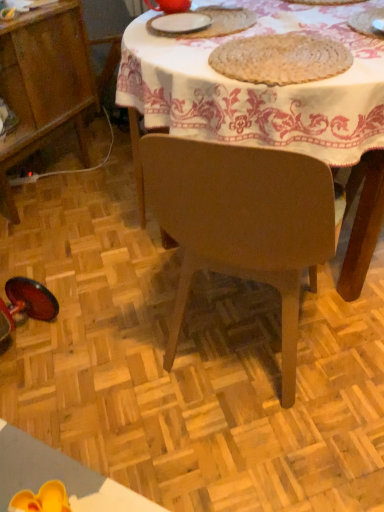
The height and width of the screenshot is (512, 384). What are the coordinates of `brown woven placemat at upper center` in the screenshot? It's located at (281, 58).

How much space does white woven placemat at upper right, which appears as the 3th tableware when viewed from the left, occupy horizontally?

15.58 inches.

Image resolution: width=384 pixels, height=512 pixels. Find the location of `white matte plate at upper center, marked as the 2th tableware in a right-to-left arrangement`. white matte plate at upper center, marked as the 2th tableware in a right-to-left arrangement is located at coordinates (179, 23).

Where is `brown woven placemat at upper center`? The image size is (384, 512). brown woven placemat at upper center is located at coordinates (281, 58).

How much distance is there between white woven placemat at upper right, which appears as the 3th tableware when viewed from the left, and brown woven placemat at upper center?

white woven placemat at upper right, which appears as the 3th tableware when viewed from the left, is 12.32 inches away from brown woven placemat at upper center.

Who is smaller, white woven placemat at upper right, which appears as the 3th tableware when viewed from the left, or brown woven placemat at upper center?

brown woven placemat at upper center is smaller.

Choose the correct answer: Is white woven placemat at upper right, which ranks as the 1th tableware in right-to-left order, inside brown woven placemat at upper center or outside it?

white woven placemat at upper right, which ranks as the 1th tableware in right-to-left order, exists outside the volume of brown woven placemat at upper center.

What's the angular difference between white woven placemat at upper right, which ranks as the 1th tableware in right-to-left order, and brown woven placemat at upper center's facing directions?

There is a 0.000447-degree angle between the facing directions of white woven placemat at upper right, which ranks as the 1th tableware in right-to-left order, and brown woven placemat at upper center.

From the image's perspective, is white matte plate at upper center, marked as the 2th tableware in a right-to-left arrangement, on top of brown woven placemat at upper center?

Yes, from the image's perspective, white matte plate at upper center, marked as the 2th tableware in a right-to-left arrangement, is above brown woven placemat at upper center.

Is white matte plate at upper center, marked as the 2th tableware in a right-to-left arrangement, inside the boundaries of brown woven placemat at upper center, or outside?

white matte plate at upper center, marked as the 2th tableware in a right-to-left arrangement, is spatially situated outside brown woven placemat at upper center.

In the scene shown: Is white matte plate at upper center, marked as the 2th tableware in a right-to-left arrangement, further to camera compared to brown woven placemat at upper center?

Yes, white matte plate at upper center, marked as the 2th tableware in a right-to-left arrangement, is further from the viewer.

Is white matte plate at upper center, the 2th tableware in the left-to-right sequence, aimed at brown woven placemat at upper center?

No.

From the image's perspective, is wooden cabinet at lower left beneath brown woven placemat at upper center?

Incorrect, from the image's perspective, wooden cabinet at lower left is higher than brown woven placemat at upper center.

Does wooden cabinet at lower left have a greater width compared to brown woven placemat at upper center?

Yes.

Is brown woven placemat at upper center at the back of wooden cabinet at lower left?

No, brown woven placemat at upper center is not at the back of wooden cabinet at lower left.

From the image's perspective, which is below, wooden cabinet at lower left or wooden table at center?

wooden table at center appears lower in the image.

Considering the relative sizes of wooden cabinet at lower left and wooden table at center in the image provided, is wooden cabinet at lower left shorter than wooden table at center?

Indeed, wooden cabinet at lower left has a lesser height compared to wooden table at center.

Between wooden cabinet at lower left and wooden table at center, which one has smaller size?

Smaller between the two is wooden cabinet at lower left.

Considering the sizes of objects wooden cabinet at lower left and wooden table at center in the image provided, who is wider, wooden cabinet at lower left or wooden table at center?

With larger width is wooden table at center.

How different are the orientations of matte red teapot at upper center, the 3th tableware in the right-to-left sequence, and white matte plate at upper center, the 2th tableware in the left-to-right sequence, in degrees?

The facing directions of matte red teapot at upper center, the 3th tableware in the right-to-left sequence, and white matte plate at upper center, the 2th tableware in the left-to-right sequence, are 6.88 degrees apart.

Considering the sizes of objects matte red teapot at upper center, arranged as the 1th tableware when viewed from the left, and white matte plate at upper center, the 2th tableware in the left-to-right sequence, in the image provided, who is smaller, matte red teapot at upper center, arranged as the 1th tableware when viewed from the left, or white matte plate at upper center, the 2th tableware in the left-to-right sequence,?

Smaller between the two is white matte plate at upper center, the 2th tableware in the left-to-right sequence.

In the scene shown: From the image's perspective, relative to white matte plate at upper center, the 2th tableware in the left-to-right sequence, is matte red teapot at upper center, arranged as the 1th tableware when viewed from the left, above or below?

matte red teapot at upper center, arranged as the 1th tableware when viewed from the left, is situated higher than white matte plate at upper center, the 2th tableware in the left-to-right sequence, in the image.

From a real-world perspective, does matte red teapot at upper center, the 3th tableware in the right-to-left sequence, sit lower than white matte plate at upper center, the 2th tableware in the left-to-right sequence?

No, from a real-world perspective, matte red teapot at upper center, the 3th tableware in the right-to-left sequence, is not under white matte plate at upper center, the 2th tableware in the left-to-right sequence.

How far apart are white matte plate at upper center, marked as the 2th tableware in a right-to-left arrangement, and white woven placemat at upper right, which ranks as the 1th tableware in right-to-left order?

The distance of white matte plate at upper center, marked as the 2th tableware in a right-to-left arrangement, from white woven placemat at upper right, which ranks as the 1th tableware in right-to-left order, is 20.31 inches.

Is white matte plate at upper center, the 2th tableware in the left-to-right sequence, taller or shorter than white woven placemat at upper right, which appears as the 3th tableware when viewed from the left?

Considering their sizes, white matte plate at upper center, the 2th tableware in the left-to-right sequence, has more height than white woven placemat at upper right, which appears as the 3th tableware when viewed from the left.

Looking at this image, from the image's perspective, is white matte plate at upper center, marked as the 2th tableware in a right-to-left arrangement, below white woven placemat at upper right, which appears as the 3th tableware when viewed from the left?

Actually, white matte plate at upper center, marked as the 2th tableware in a right-to-left arrangement, appears above white woven placemat at upper right, which appears as the 3th tableware when viewed from the left, in the image.

From the picture: Which of these two, white matte plate at upper center, marked as the 2th tableware in a right-to-left arrangement, or white woven placemat at upper right, which ranks as the 1th tableware in right-to-left order, is bigger?

With larger size is white woven placemat at upper right, which ranks as the 1th tableware in right-to-left order.

Looking at this image, between matte red teapot at upper center, arranged as the 1th tableware when viewed from the left, and wooden table at center, which one appears on the left side from the viewer's perspective?

Positioned to the left is matte red teapot at upper center, arranged as the 1th tableware when viewed from the left.

Is wooden table at center a part of matte red teapot at upper center, the 3th tableware in the right-to-left sequence?

Actually, wooden table at center is outside matte red teapot at upper center, the 3th tableware in the right-to-left sequence.

Does point (156, 2) appear closer or farther from the camera than point (355, 104)?

Point (156, 2) is farther from the camera than point (355, 104).

From the image's perspective, which is below, matte red teapot at upper center, arranged as the 1th tableware when viewed from the left, or wooden table at center?

From the image's view, wooden table at center is below.

You are a GUI agent. You are given a task and a screenshot of the screen. Output one action in this format:
    pyautogui.click(x=<x>, y=<y>)
    Task: Click on the food to the left of white woven placemat at upper right, which ranks as the 1th tableware in right-to-left order
    
    Given the screenshot: What is the action you would take?
    pyautogui.click(x=281, y=58)

At what (x,y) coordinates should I click in order to perform the action: click on food on the right of the white matte plate at upper center, marked as the 2th tableware in a right-to-left arrangement. Please return your answer as a coordinate pair (x, y). Looking at the image, I should click on (281, 58).

When comparing their distances from matte red teapot at upper center, the 3th tableware in the right-to-left sequence, does white woven placemat at upper right, which appears as the 3th tableware when viewed from the left, or white matte plate at upper center, the 2th tableware in the left-to-right sequence, seem further?

white woven placemat at upper right, which appears as the 3th tableware when viewed from the left, is further to matte red teapot at upper center, the 3th tableware in the right-to-left sequence.

Considering their positions, is matte red teapot at upper center, arranged as the 1th tableware when viewed from the left, positioned further to wooden cabinet at lower left than white woven placemat at upper right, which appears as the 3th tableware when viewed from the left?

Based on the image, white woven placemat at upper right, which appears as the 3th tableware when viewed from the left, appears to be further to wooden cabinet at lower left.

Which object lies further to the anchor point wooden table at center, brown woven placemat at upper center or white matte plate at upper center, the 2th tableware in the left-to-right sequence?

Based on the image, white matte plate at upper center, the 2th tableware in the left-to-right sequence, appears to be further to wooden table at center.

Based on their spatial positions, is matte red teapot at upper center, arranged as the 1th tableware when viewed from the left, or wooden cabinet at lower left closer to brown woven placemat at upper center?

matte red teapot at upper center, arranged as the 1th tableware when viewed from the left, is positioned closer to the anchor brown woven placemat at upper center.

Considering their positions, is brown woven placemat at upper center positioned further to white woven placemat at upper right, which appears as the 3th tableware when viewed from the left, than wooden cabinet at lower left?

wooden cabinet at lower left lies further to white woven placemat at upper right, which appears as the 3th tableware when viewed from the left, than the other object.

Considering their positions, is white matte plate at upper center, the 2th tableware in the left-to-right sequence, positioned closer to wooden cabinet at lower left than white woven placemat at upper right, which appears as the 3th tableware when viewed from the left?

white matte plate at upper center, the 2th tableware in the left-to-right sequence, is closer to wooden cabinet at lower left.

Which object lies nearer to the anchor point matte red teapot at upper center, the 3th tableware in the right-to-left sequence, white woven placemat at upper right, which ranks as the 1th tableware in right-to-left order, or wooden cabinet at lower left?

wooden cabinet at lower left is closer to matte red teapot at upper center, the 3th tableware in the right-to-left sequence.

Which object lies further to the anchor point wooden table at center, white woven placemat at upper right, which ranks as the 1th tableware in right-to-left order, or white matte plate at upper center, marked as the 2th tableware in a right-to-left arrangement?

The object further to wooden table at center is white woven placemat at upper right, which ranks as the 1th tableware in right-to-left order.

The width and height of the screenshot is (384, 512). Find the location of `tableware between wooden cabinet at lower left and white matte plate at upper center, marked as the 2th tableware in a right-to-left arrangement, in the horizontal direction`. tableware between wooden cabinet at lower left and white matte plate at upper center, marked as the 2th tableware in a right-to-left arrangement, in the horizontal direction is located at coordinates (169, 5).

Locate an element on the screen. The height and width of the screenshot is (512, 384). food located between wooden cabinet at lower left and white woven placemat at upper right, which ranks as the 1th tableware in right-to-left order, in the left-right direction is located at coordinates (281, 58).

Locate an element on the screen. table between matte red teapot at upper center, the 3th tableware in the right-to-left sequence, and white woven placemat at upper right, which appears as the 3th tableware when viewed from the left is located at coordinates (272, 105).

This screenshot has height=512, width=384. What are the coordinates of `table between wooden cabinet at lower left and white woven placemat at upper right, which appears as the 3th tableware when viewed from the left, from left to right` in the screenshot? It's located at (272, 105).